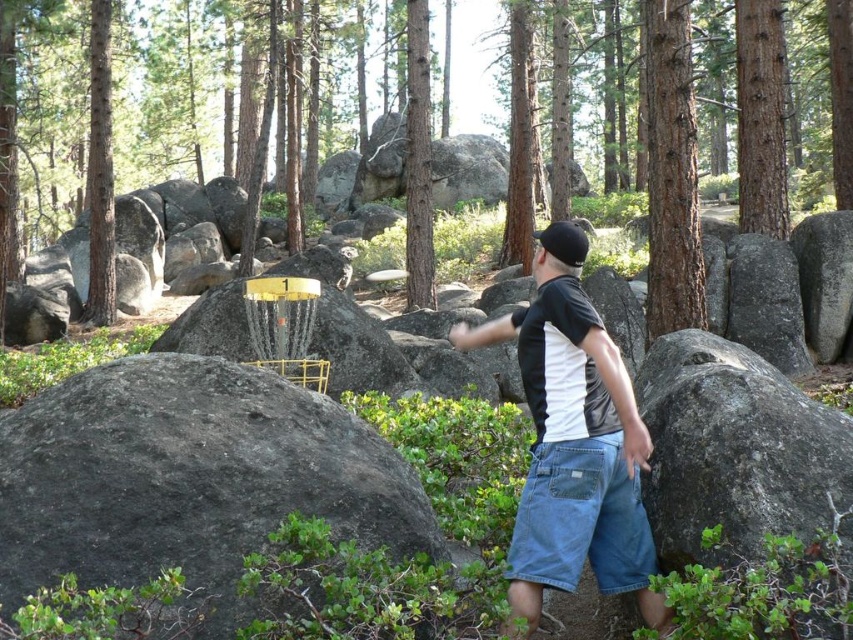
You are a hiker trying to navigate through the forest. You see a gray rock at center and a smooth brown tree trunk at left. Which object is wider?

The smooth brown tree trunk at left is wider than the gray rock at center.